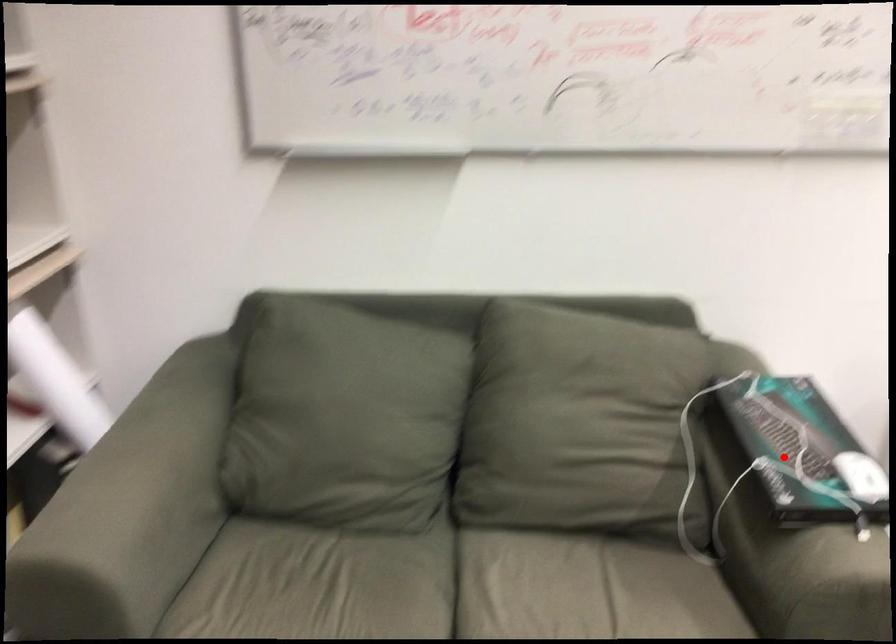
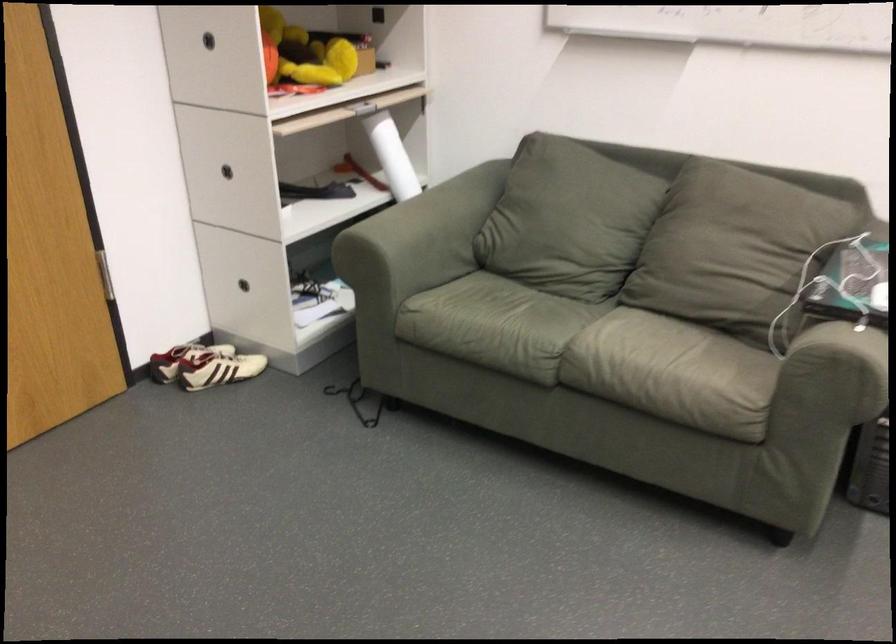
Where in the second image is the point corresponding to the highlighted location from the first image?

(851, 279)